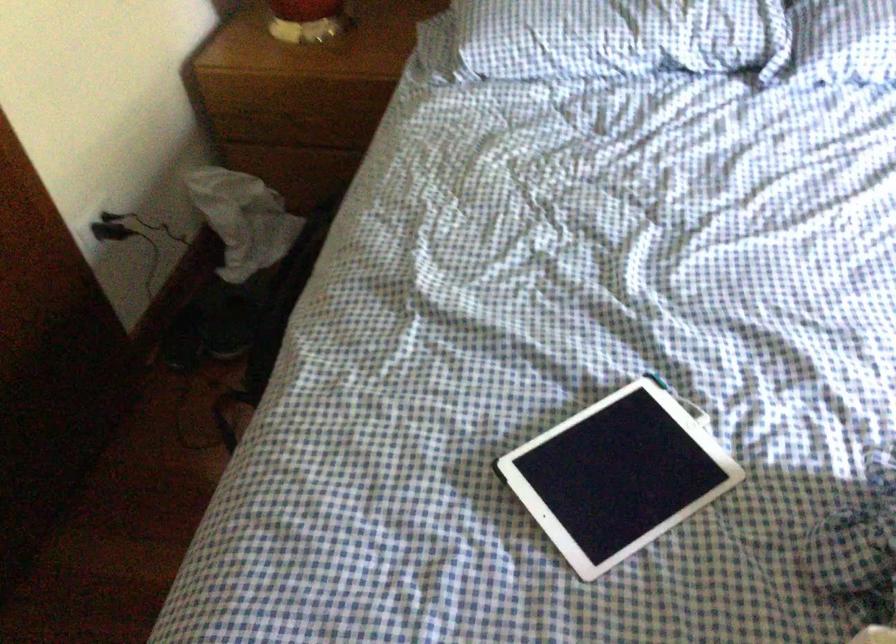
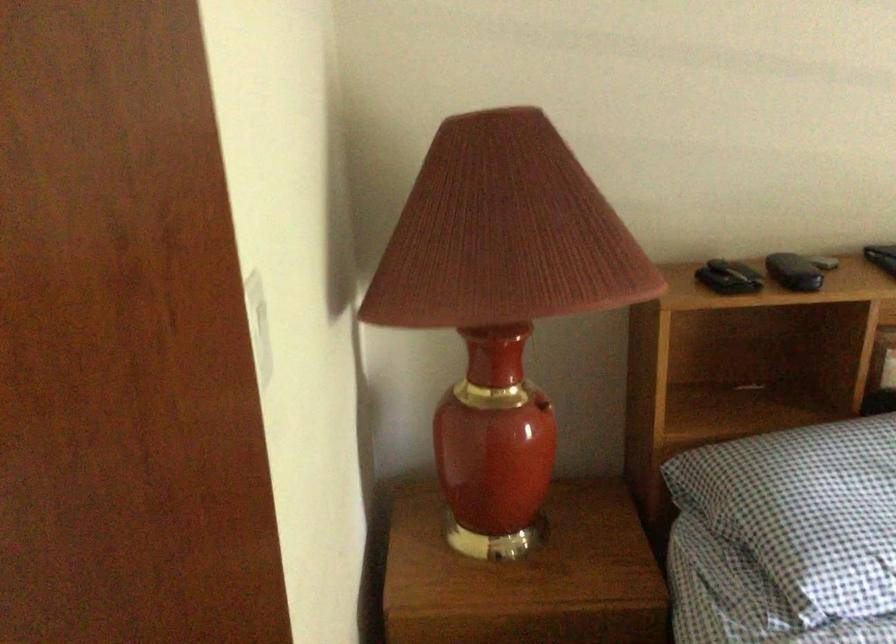
Looking at this image, which direction would the cameraman need to move to produce the second image?

The cameraman moved toward left, forward.